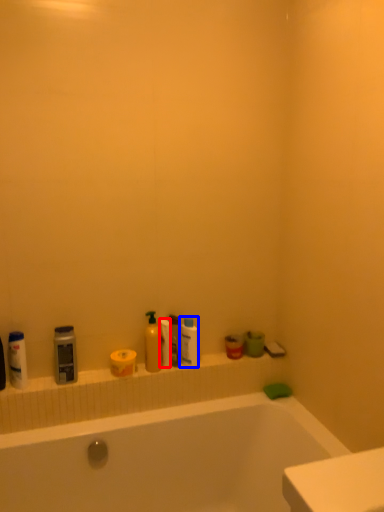
Question: Which of the following is the closest to the observer, toilet paper (highlighted by a red box) or toiletry (highlighted by a blue box)?

Choices:
 (A) toilet paper
 (B) toiletry

Answer: (A)